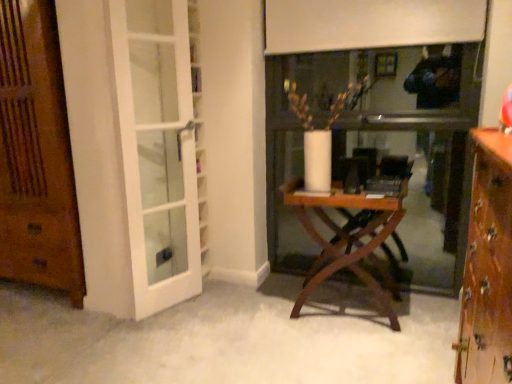
Identify the location of vacant region under wooden folding table at center (from a real-world perspective). click(343, 301).